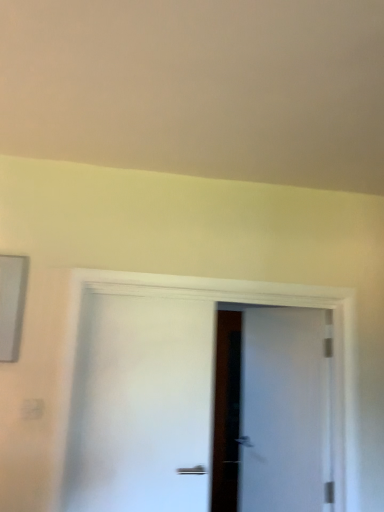
Question: Is white matte door at center, which is counted as the 2th door, starting from the back, facing away from white matte door at center, which is the 2th door from left to right?

Choices:
 (A) yes
 (B) no

Answer: (B)

Question: From the image's perspective, is white matte door at center, the first door in the left-to-right sequence, on white matte door at center, which is the second door from front to back?

Choices:
 (A) yes
 (B) no

Answer: (A)

Question: Is white matte door at center, the 1th door viewed from the back, surrounded by white matte door at center, which is counted as the 2th door, starting from the back?

Choices:
 (A) yes
 (B) no

Answer: (B)

Question: Is white matte door at center, the first door when ordered from front to back, at the left side of white matte door at center, acting as the first door starting from the right?

Choices:
 (A) yes
 (B) no

Answer: (A)

Question: Does white matte door at center, which is counted as the 2th door, starting from the back, turn towards white matte door at center, acting as the first door starting from the right?

Choices:
 (A) yes
 (B) no

Answer: (B)

Question: Would you consider white matte door at center, the first door in the left-to-right sequence, to be distant from white matte door at center, acting as the first door starting from the right?

Choices:
 (A) yes
 (B) no

Answer: (B)

Question: From the image's perspective, is white matte door at center, which is the second door from front to back, located beneath white matte door at center, the first door when ordered from front to back?

Choices:
 (A) yes
 (B) no

Answer: (A)

Question: Can you confirm if white matte door at center, the 1th door viewed from the back, is wider than white matte door at center, the first door when ordered from front to back?

Choices:
 (A) yes
 (B) no

Answer: (A)

Question: Considering the relative sizes of white matte door at center, which is the 2th door from left to right, and white matte door at center, the first door in the left-to-right sequence, in the image provided, is white matte door at center, which is the 2th door from left to right, taller than white matte door at center, the first door in the left-to-right sequence,?

Choices:
 (A) no
 (B) yes

Answer: (B)

Question: Is white matte door at center, which is the second door from front to back, not near white matte door at center, which is the 2th door from right to left?

Choices:
 (A) no
 (B) yes

Answer: (A)

Question: Is white matte door at center, which is the second door from front to back, closer to the viewer compared to white matte door at center, the first door when ordered from front to back?

Choices:
 (A) yes
 (B) no

Answer: (B)

Question: From a real-world perspective, is white matte door at center, which is the second door from front to back, positioned under white matte door at center, the first door in the left-to-right sequence, based on gravity?

Choices:
 (A) no
 (B) yes

Answer: (B)

Question: Based on their sizes in the image, would you say white matte door at center, the first door when ordered from front to back, is bigger or smaller than white matte door at center, the 1th door viewed from the back?

Choices:
 (A) small
 (B) big

Answer: (A)